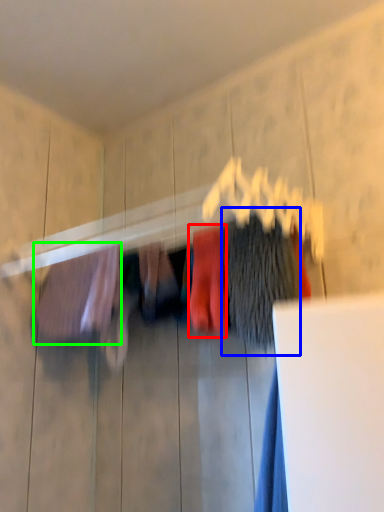
Question: Considering the real-world distances, which object is farthest from clothing (highlighted by a red box)? clothing (highlighted by a blue box) or clothing (highlighted by a green box)?

Choices:
 (A) clothing
 (B) clothing

Answer: (B)